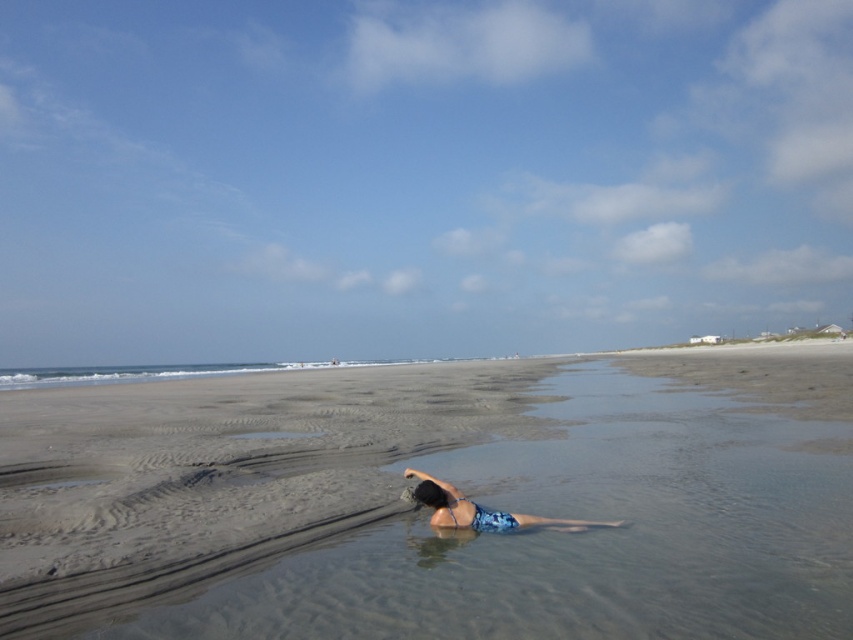
You are planning to build a sandcastle on the beach. Given the smooth sand at lower center and the blue printed swimsuit at center, which object would be more suitable for building a sandcastle and why?

The smooth sand at lower center is more suitable for building a sandcastle because it has a larger size compared to the blue printed swimsuit at center, making it easier to mold and shape into structures.

You are a photographer trying to capture the scene of the beach. You want to ensure that the blue printed swimsuit at center is visible above the smooth sand at lower center in your photo. Based on the scene description, will this be possible?

Yes, the blue printed swimsuit at center is above the smooth sand at lower center, so it will be visible in the photo.